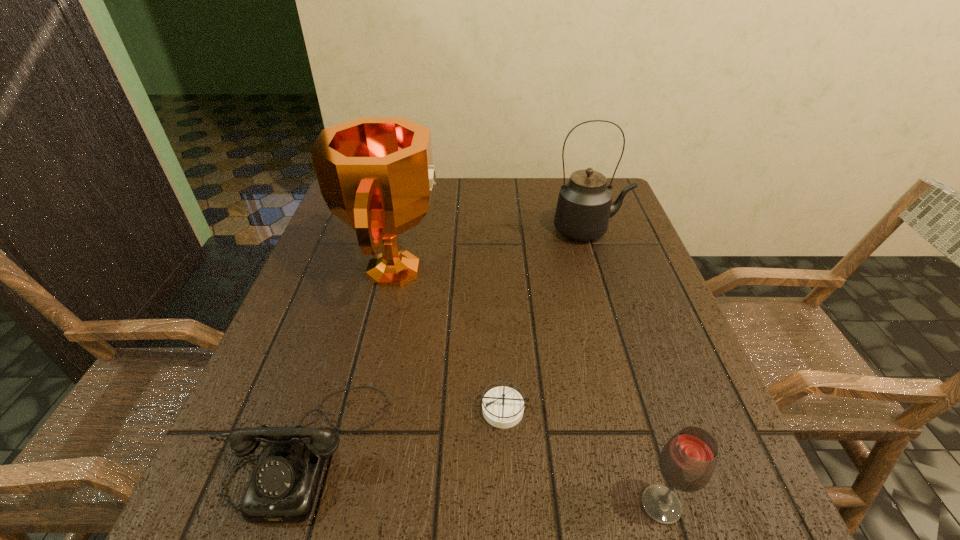
The width and height of the screenshot is (960, 540). I want to click on glass drink container that is positioned at the near edge, so click(687, 462).

This screenshot has height=540, width=960. I want to click on telephone located in the near edge section of the desktop, so click(283, 487).

Locate an element on the screen. award located at the left edge is located at coordinates (376, 174).

Locate an element on the screen. telephone located at the left edge is located at coordinates (283, 487).

Locate an element on the screen. This screenshot has height=540, width=960. kettle present at the right edge is located at coordinates [x=584, y=206].

You are a GUI agent. You are given a task and a screenshot of the screen. Output one action in this format:
    pyautogui.click(x=<x>, y=<y>)
    Task: Click on the glass drink container that is at the right edge
    This screenshot has width=960, height=540.
    Given the screenshot: What is the action you would take?
    pyautogui.click(x=687, y=462)

Where is `object at the near left corner`? object at the near left corner is located at coordinates (283, 487).

Locate an element on the screen. object that is positioned at the far right corner is located at coordinates (584, 206).

Locate an element on the screen. The image size is (960, 540). object present at the near right corner is located at coordinates (687, 462).

Where is `blank space at the far edge of the desktop`? This screenshot has height=540, width=960. blank space at the far edge of the desktop is located at coordinates (488, 194).